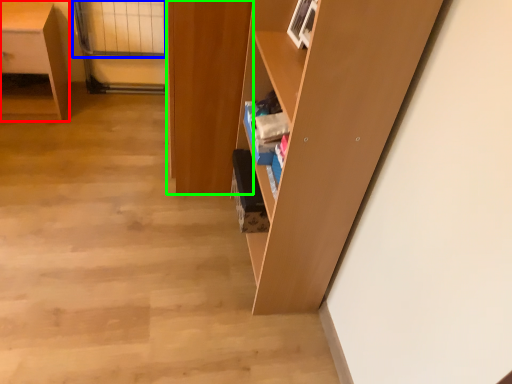
Question: Which object is positioned farthest from desk (highlighted by a red box)? Select from glass door (highlighted by a blue box) and cabinetry (highlighted by a green box).

Choices:
 (A) glass door
 (B) cabinetry

Answer: (B)